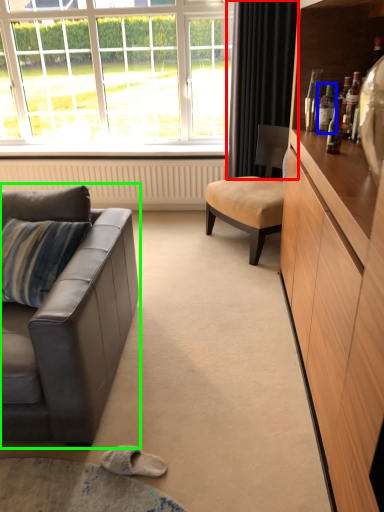
Question: Which object is the closest to the curtain (highlighted by a red box)? Choose among these: bottle (highlighted by a blue box) or studio couch (highlighted by a green box).

Choices:
 (A) bottle
 (B) studio couch

Answer: (A)